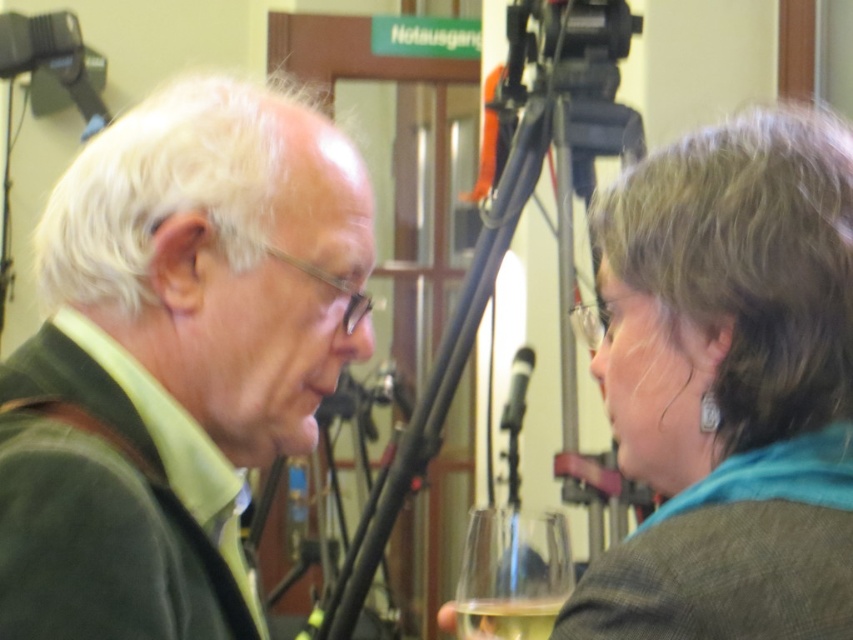
Is gray wool scarf at upper right shorter than black metal tripod at center?

Yes, gray wool scarf at upper right is shorter than black metal tripod at center.

Is point (650, 438) in front of point (595, 140)?

Yes, it is.

This screenshot has width=853, height=640. Describe the element at coordinates (729, 385) in the screenshot. I see `gray wool scarf at upper right` at that location.

This screenshot has width=853, height=640. Identify the location of gray wool scarf at upper right. [x=729, y=385].

Who is lower down, black metal tripod at center or black matte microphone at center?

Positioned lower is black metal tripod at center.

Can you confirm if black metal tripod at center is positioned below black matte microphone at center?

Yes.

The image size is (853, 640). What do you see at coordinates (490, 280) in the screenshot?
I see `black metal tripod at center` at bounding box center [490, 280].

The image size is (853, 640). Find the location of `black metal tripod at center`. black metal tripod at center is located at coordinates (490, 280).

Who is lower down, green matte sweater at left or translucent glass at lower center?

translucent glass at lower center

Where is `green matte sweater at left`? This screenshot has height=640, width=853. green matte sweater at left is located at coordinates (173, 356).

Locate an element on the screen. green matte sweater at left is located at coordinates (173, 356).